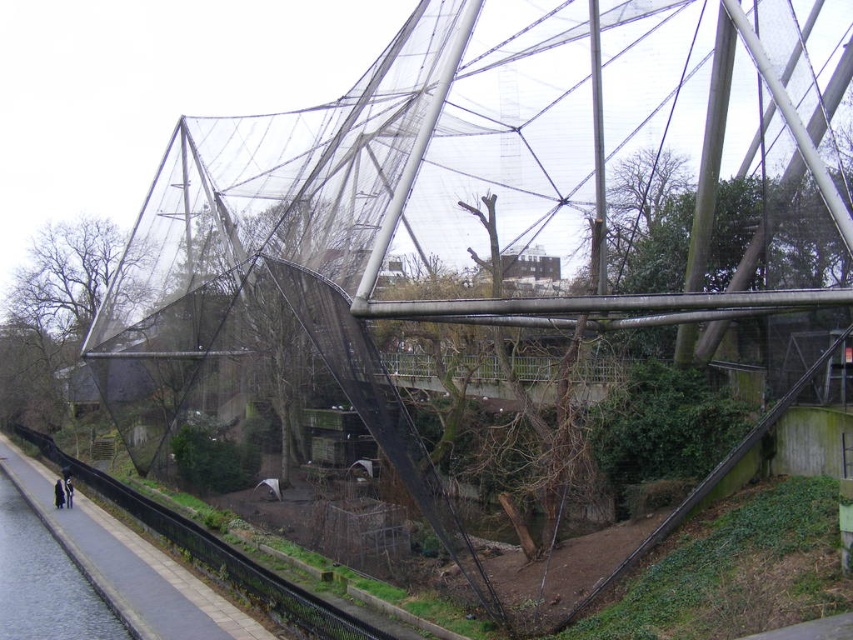
Question: Which object appears closest to the camera in this image?

Choices:
 (A) dark blue fabric at lower left
 (B) concrete sidewalk at lower left
 (C) smooth gray water at lower left

Answer: (B)

Question: Which object appears closest to the camera in this image?

Choices:
 (A) smooth gray water at lower left
 (B) dark blue jacket at lower left

Answer: (A)

Question: Which point is closer to the camera?

Choices:
 (A) dark blue fabric at lower left
 (B) smooth gray water at lower left
 (C) dark blue jacket at lower left
 (D) concrete sidewalk at lower left

Answer: (D)

Question: Can you confirm if concrete sidewalk at lower left is wider than smooth gray water at lower left?

Choices:
 (A) no
 (B) yes

Answer: (B)

Question: Can you confirm if concrete sidewalk at lower left is thinner than smooth gray water at lower left?

Choices:
 (A) yes
 (B) no

Answer: (B)

Question: From the image, what is the correct spatial relationship of smooth gray water at lower left in relation to dark blue fabric at lower left?

Choices:
 (A) left
 (B) right

Answer: (B)